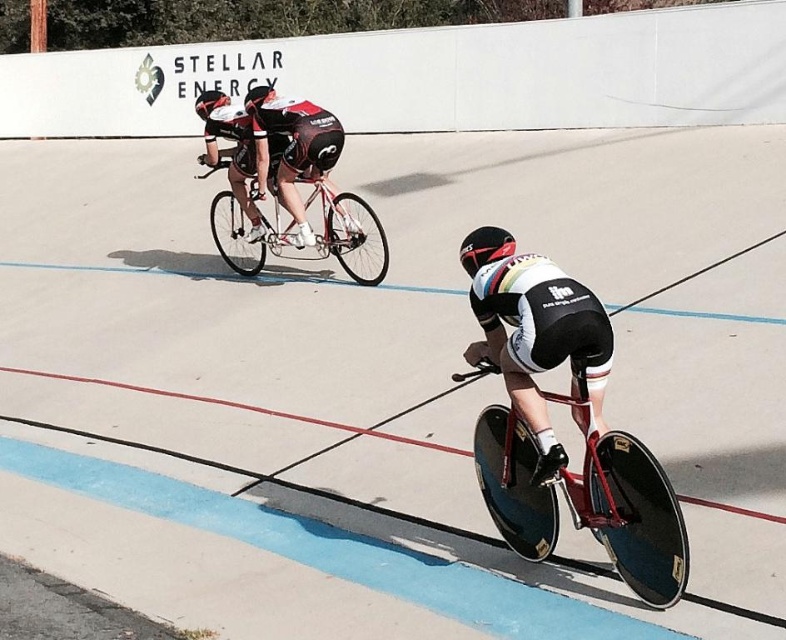
Question: Estimate the real-world distances between objects in this image. Which object is closer to the shiny red bike at lower right?

Choices:
 (A) black matte helmet at center
 (B) shiny metallic bicycle at center

Answer: (A)

Question: Which object is the closest to the black matte helmet at center?

Choices:
 (A) shiny metallic bicycle at center
 (B) shiny black bicycle at center
 (C) shiny red bike at lower right

Answer: (B)

Question: Is shiny metallic bicycle at center below black matte helmet at center?

Choices:
 (A) no
 (B) yes

Answer: (A)

Question: Among these objects, which one is nearest to the camera?

Choices:
 (A) black matte helmet at center
 (B) shiny red bike at lower right

Answer: (B)

Question: Does shiny black bicycle at center appear on the left side of shiny metallic bicycle at center?

Choices:
 (A) no
 (B) yes

Answer: (A)

Question: Does shiny red bike at lower right have a larger size compared to black matte helmet at center?

Choices:
 (A) yes
 (B) no

Answer: (A)